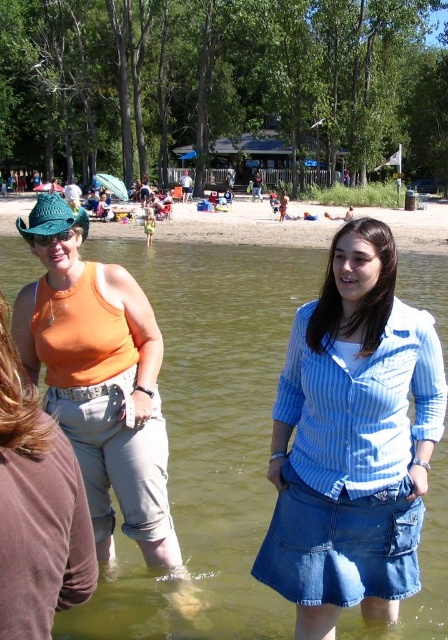
Question: Which object is the farthest from the orange matte tank top at left?

Choices:
 (A) greenish water at center
 (B) matte green goggles at upper left

Answer: (A)

Question: Does blue striped shirt at center have a greater width compared to matte green goggles at upper left?

Choices:
 (A) no
 (B) yes

Answer: (A)

Question: Does blue striped shirt at center appear over orange matte tank top at left?

Choices:
 (A) no
 (B) yes

Answer: (A)

Question: From the image, what is the correct spatial relationship of greenish water at center in relation to orange matte tank top at upper left?

Choices:
 (A) right
 (B) left

Answer: (B)

Question: Which object is the closest to the orange matte tank top at left?

Choices:
 (A) orange matte tank top at upper left
 (B) matte green goggles at upper left
 (C) greenish water at center

Answer: (B)

Question: Considering the real-world distances, which object is farthest from the greenish water at center?

Choices:
 (A) blue striped shirt at center
 (B) matte green goggles at upper left
 (C) orange matte tank top at upper left

Answer: (A)